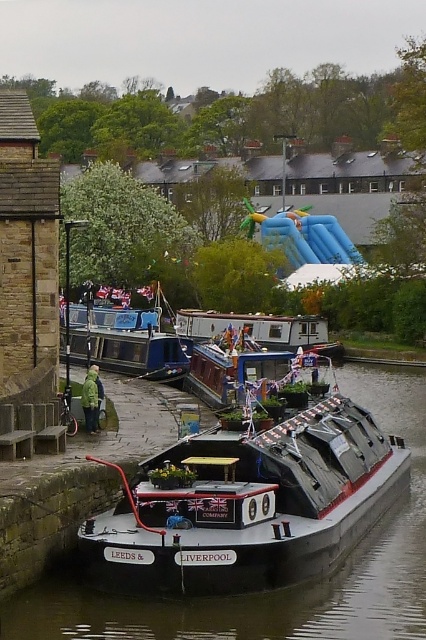
You are a photographer planning to take a photo of the wooden polished boat at center and the green matte jacket at lower left. Since you want both subjects to appear equally prominent in the photo, which subject should you move closer to, and why?

You should move closer to the green matte jacket at lower left because it is smaller in size compared to the wooden polished boat at center. By moving closer to the smaller subject, you can balance their prominence in the photo.

You are planning to move the matte blue boat at center and the wooden polished boat at center closer to the inflatable slide in the background. Based on their sizes, which boat would require more space to maneuver around the other boats in the canal?

The wooden polished boat at center is larger than the matte blue boat at center, so it would require more space to maneuver around the other boats in the canal.